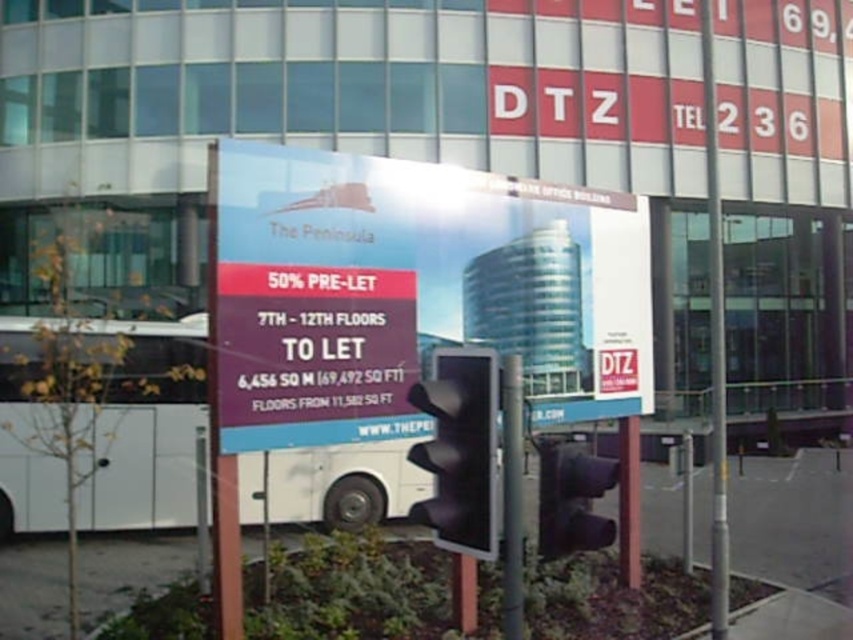
Question: Can you confirm if white glossy billboard at center is positioned below silver metallic pole at center?

Choices:
 (A) yes
 (B) no

Answer: (A)

Question: Can you confirm if white glossy billboard at center is positioned to the right of silver metallic pole at center?

Choices:
 (A) yes
 (B) no

Answer: (B)

Question: Which object is positioned farthest from the gray metallic pole at center?

Choices:
 (A) silver metallic pole at center
 (B) matte black traffic light at center

Answer: (A)

Question: Does black matte traffic light at center appear on the left side of gray metallic pole at center?

Choices:
 (A) no
 (B) yes

Answer: (B)

Question: Which point is farther to the camera?

Choices:
 (A) (722, 488)
 (B) (306, 260)

Answer: (A)

Question: Which point appears closest to the camera in this image?

Choices:
 (A) (508, 598)
 (B) (706, 54)

Answer: (A)